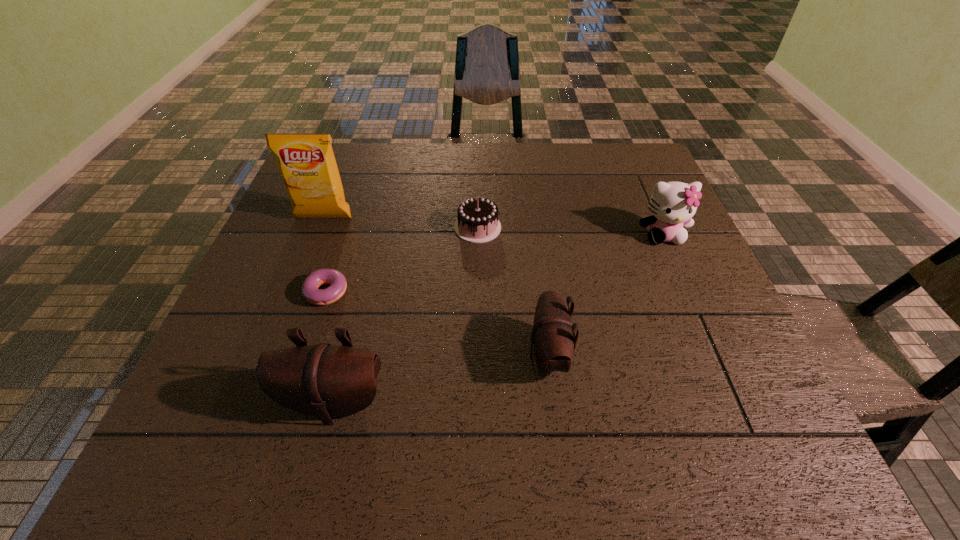
The image size is (960, 540). Find the location of `the taller pouch`. the taller pouch is located at coordinates (326, 381).

At what (x,y) coordinates should I click in order to perform the action: click on the second object from right to left. Please return your answer as a coordinate pair (x, y). The width and height of the screenshot is (960, 540). Looking at the image, I should click on (553, 336).

I want to click on the shorter pouch, so click(553, 336).

This screenshot has height=540, width=960. I want to click on the third object from right to left, so click(x=477, y=222).

Locate an element on the screen. chocolate cake is located at coordinates (477, 222).

The width and height of the screenshot is (960, 540). I want to click on kitten, so click(x=672, y=204).

The height and width of the screenshot is (540, 960). I want to click on doughnut, so click(310, 291).

Locate an element on the screen. This screenshot has width=960, height=540. the third nearest object is located at coordinates (310, 291).

Locate an element on the screen. the tallest object is located at coordinates (307, 164).

The image size is (960, 540). Find the location of `vacant area situated 0.340m with the flap open on the shorter pouch`. vacant area situated 0.340m with the flap open on the shorter pouch is located at coordinates pyautogui.click(x=354, y=355).